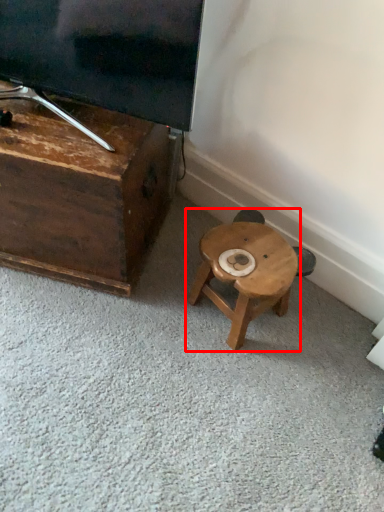
Question: Observing the image, what is the correct spatial positioning of stool (annotated by the red box) in reference to furniture?

Choices:
 (A) right
 (B) left

Answer: (A)